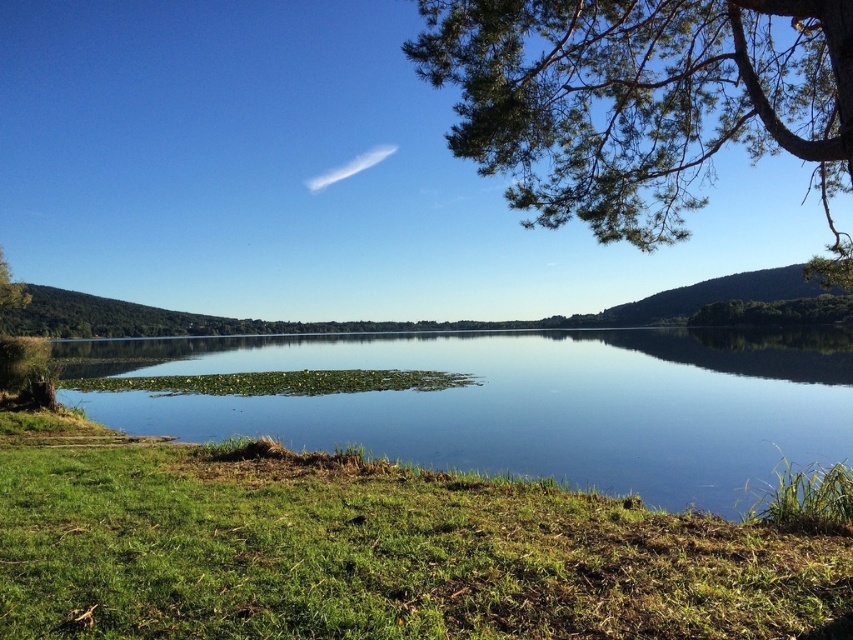
Can you confirm if green grass at lower left is positioned to the left of clear blue water at center?

No, green grass at lower left is not to the left of clear blue water at center.

The image size is (853, 640). What do you see at coordinates (370, 550) in the screenshot? I see `green grass at lower left` at bounding box center [370, 550].

Locate an element on the screen. The height and width of the screenshot is (640, 853). green grass at lower left is located at coordinates (370, 550).

Looking at this image, does green grass at lower left have a greater width compared to green leafy branches at upper right?

No.

What do you see at coordinates (370, 550) in the screenshot?
I see `green grass at lower left` at bounding box center [370, 550].

Is point (436, 627) behind point (549, 182)?

No, (436, 627) is closer to viewer.

The height and width of the screenshot is (640, 853). I want to click on green grass at lower left, so click(370, 550).

Can you confirm if clear blue water at center is shorter than green leafy branches at upper right?

Correct, clear blue water at center is not as tall as green leafy branches at upper right.

Which is in front, point (161, 412) or point (730, 113)?

Positioned in front is point (730, 113).

The width and height of the screenshot is (853, 640). I want to click on clear blue water at center, so click(x=521, y=403).